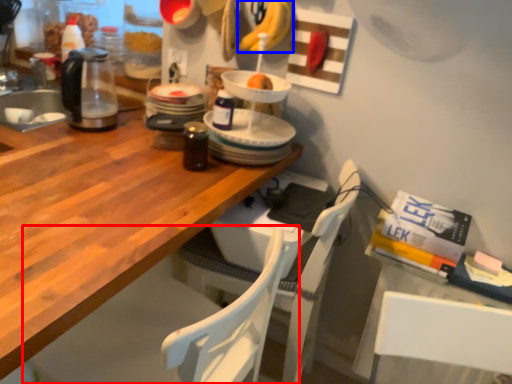
Question: Which object appears closest to the camera in this image, chair (highlighted by a red box) or banana (highlighted by a blue box)?

Choices:
 (A) chair
 (B) banana

Answer: (A)